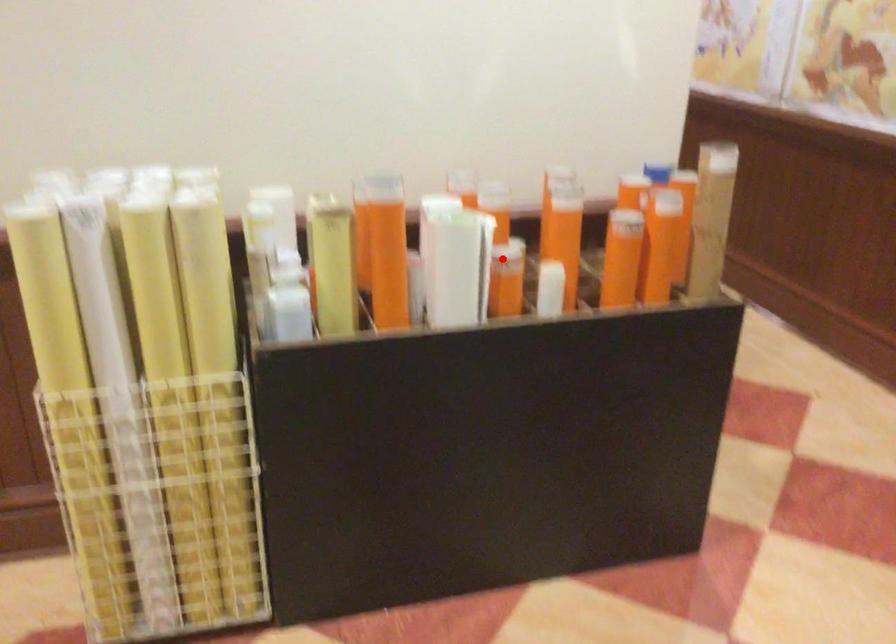
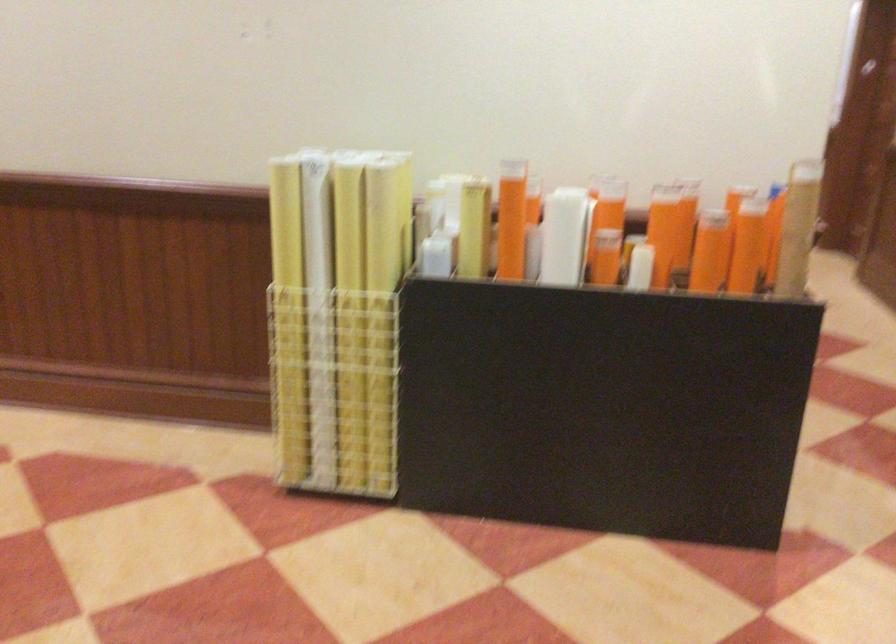
Question: I am providing you with two images of the same scene from different viewpoints. A red point is marked on the first image. At the location where the point appears in image 1, is it still visible in image 2?

Choices:
 (A) Yes
 (B) No

Answer: (A)